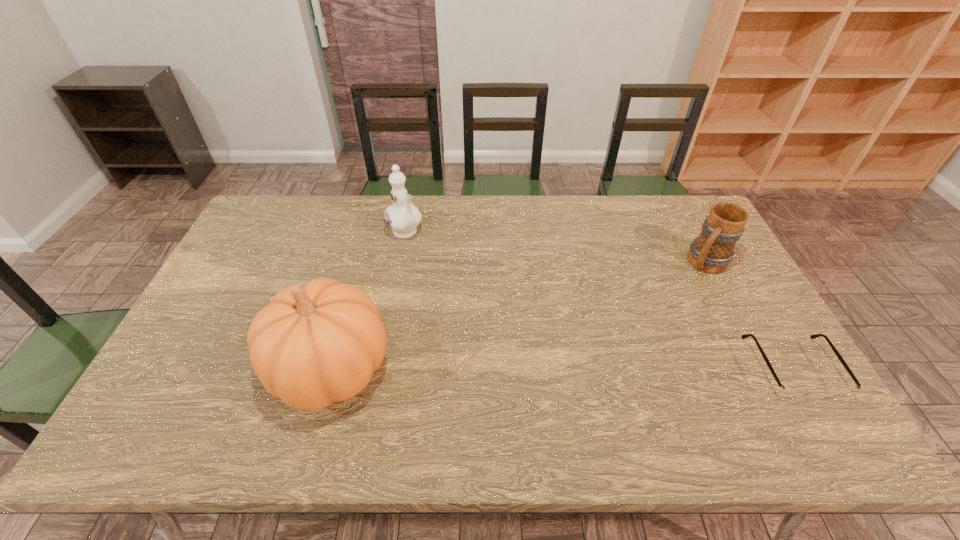
Where is `vacant region at the left edge`? The width and height of the screenshot is (960, 540). vacant region at the left edge is located at coordinates (276, 262).

Identify the location of free region at the right edge. Image resolution: width=960 pixels, height=540 pixels. (726, 328).

At what (x,y) coordinates should I click in order to perform the action: click on vacant space at the far left corner of the desktop. Please return your answer as a coordinate pair (x, y). The height and width of the screenshot is (540, 960). Looking at the image, I should click on (265, 222).

Identify the location of empty space between the spectacles and the chinaware. (598, 301).

The width and height of the screenshot is (960, 540). What are the coordinates of `empty space that is in between the second farthest object and the shortest object` in the screenshot? It's located at (749, 316).

Find the location of `empty location between the spectacles and the pumpkin`. empty location between the spectacles and the pumpkin is located at coordinates (561, 369).

Image resolution: width=960 pixels, height=540 pixels. What are the coordinates of `blank region between the spectacles and the pumpkin` in the screenshot? It's located at (561, 369).

Locate an element on the screen. free spot between the spectacles and the pumpkin is located at coordinates (561, 369).

The image size is (960, 540). Find the location of `vacant space that is in between the spectacles and the second farthest object`. vacant space that is in between the spectacles and the second farthest object is located at coordinates (749, 316).

Locate an element on the screen. free space between the third tallest object and the chinaware is located at coordinates (555, 248).